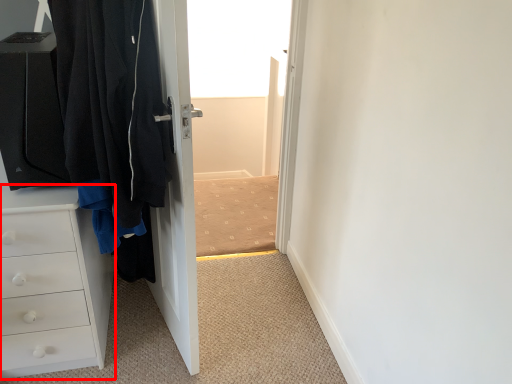
Question: From the image's perspective, considering the relative positions of chest of drawers (annotated by the red box) and door in the image provided, where is chest of drawers (annotated by the red box) located with respect to the staircase?

Choices:
 (A) above
 (B) below

Answer: (B)